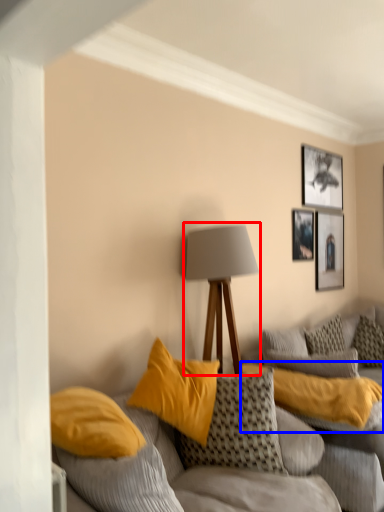
Question: Which object appears closest to the camera in this image, lamp (highlighted by a red box) or pillow (highlighted by a blue box)?

Choices:
 (A) lamp
 (B) pillow

Answer: (B)